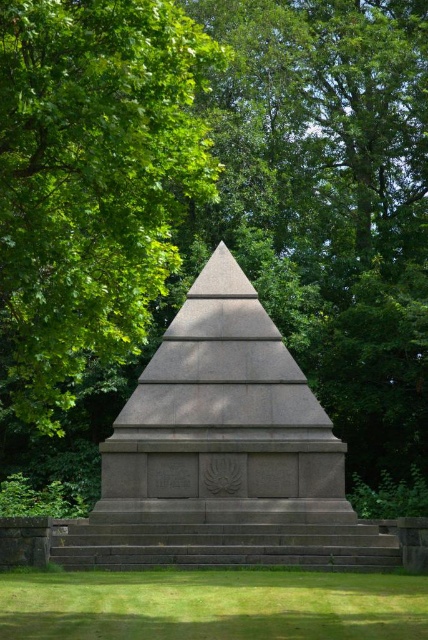
Question: Among these points, which one is nearest to the camera?

Choices:
 (A) (83, 60)
 (B) (207, 637)

Answer: (B)

Question: Which object is farther from the camera taking this photo?

Choices:
 (A) gray stone pyramid at center
 (B) green leafy tree at center
 (C) green grass at lower center

Answer: (A)

Question: Considering the real-world distances, which object is closest to the green grass at lower center?

Choices:
 (A) green leafy tree at center
 (B) gray stone pyramid at center

Answer: (A)

Question: Can you confirm if gray stone pyramid at center is positioned above green grass at lower center?

Choices:
 (A) yes
 (B) no

Answer: (A)

Question: Is green leafy tree at center thinner than gray stone pyramid at center?

Choices:
 (A) yes
 (B) no

Answer: (B)

Question: Is gray stone pyramid at center to the left of green grass at lower center from the viewer's perspective?

Choices:
 (A) yes
 (B) no

Answer: (A)